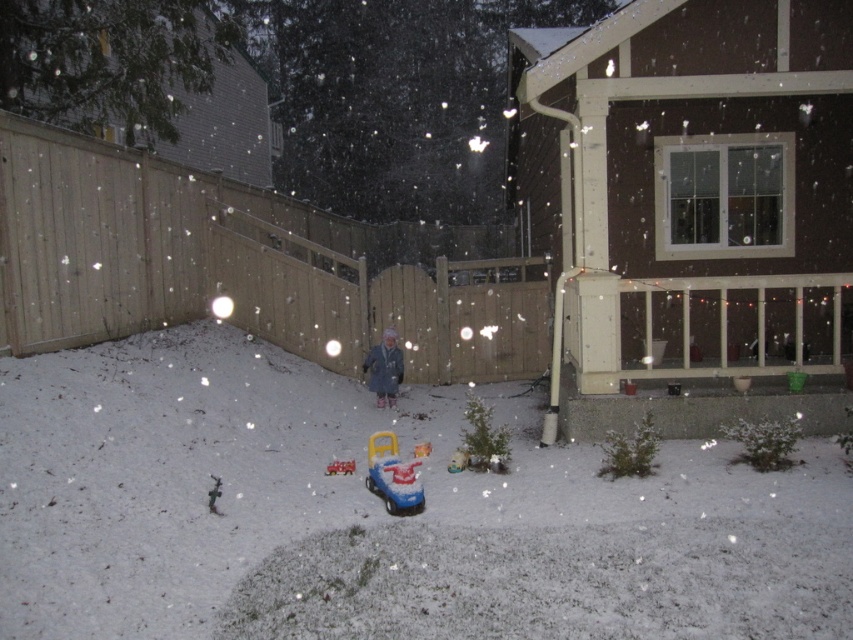
Does blue plastic toy car at center have a greater width compared to matte gray coat at center?

Incorrect, blue plastic toy car at center's width does not surpass matte gray coat at center's.

Measure the distance between blue plastic toy car at center and matte gray coat at center.

They are 3.43 meters apart.

Measure the distance between blue plastic toy car at center and camera.

They are 20.28 feet apart.

Locate an element on the screen. blue plastic toy car at center is located at coordinates (393, 474).

Between point (395, 451) and point (335, 468), which one is positioned in front?

Point (395, 451) is in front.

Is the position of blue plastic toy car at center less distant than that of shiny plastic toy car at center?

Yes, it is.

This screenshot has height=640, width=853. In order to click on blue plastic toy car at center in this screenshot , I will do `click(393, 474)`.

Find the location of `blue plastic toy car at center`. blue plastic toy car at center is located at coordinates (393, 474).

Can you confirm if matte gray coat at center is positioned above shiny plastic toy car at center?

Yes.

Can you confirm if matte gray coat at center is wider than shiny plastic toy car at center?

Correct, the width of matte gray coat at center exceeds that of shiny plastic toy car at center.

Where is `matte gray coat at center`? This screenshot has height=640, width=853. matte gray coat at center is located at coordinates (384, 369).